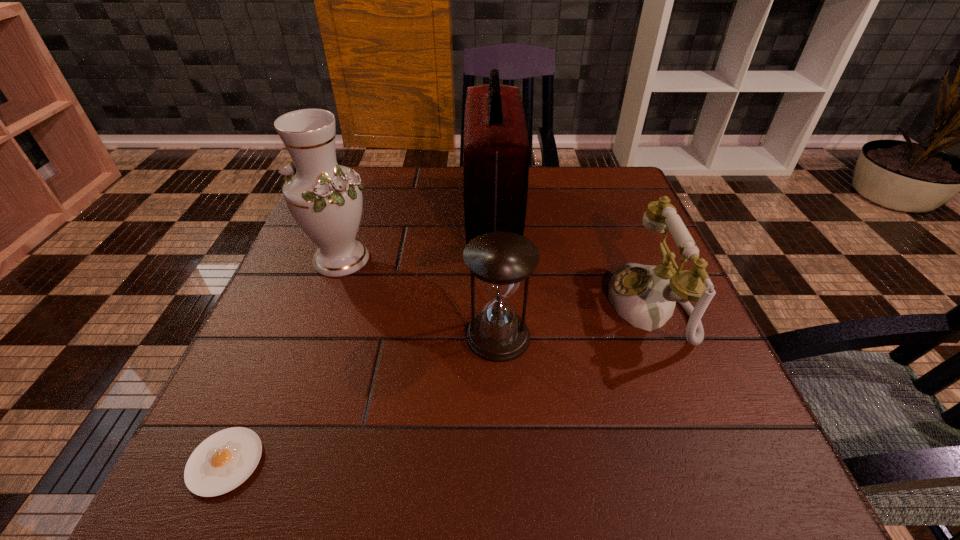
Locate an element on the screen. This screenshot has width=960, height=540. object that is at the near left corner is located at coordinates (223, 461).

The image size is (960, 540). In the image, there is a desktop. Identify the location of free region at the far edge. (533, 185).

This screenshot has width=960, height=540. Find the location of `vacant space at the near edge of the desktop`. vacant space at the near edge of the desktop is located at coordinates (602, 482).

Where is `vacant space at the left edge of the desktop`? vacant space at the left edge of the desktop is located at coordinates (243, 392).

In the image, there is a desktop. Identify the location of blank space at the right edge. The width and height of the screenshot is (960, 540). (632, 380).

The image size is (960, 540). I want to click on vacant position at the far right corner of the desktop, so click(607, 167).

In the image, there is a desktop. Identify the location of free space at the near right corner. This screenshot has width=960, height=540. (780, 495).

Image resolution: width=960 pixels, height=540 pixels. I want to click on free space between the egg yolk and the hourglass, so click(x=362, y=399).

The height and width of the screenshot is (540, 960). I want to click on vacant area that lies between the first aid kit and the vase, so click(x=417, y=235).

You are a GUI agent. You are given a task and a screenshot of the screen. Output one action in this format:
    pyautogui.click(x=<x>, y=<y>)
    Task: Click on the vacant space that's between the shortest object and the hourglass
    This screenshot has height=540, width=960.
    Given the screenshot: What is the action you would take?
    pyautogui.click(x=362, y=399)